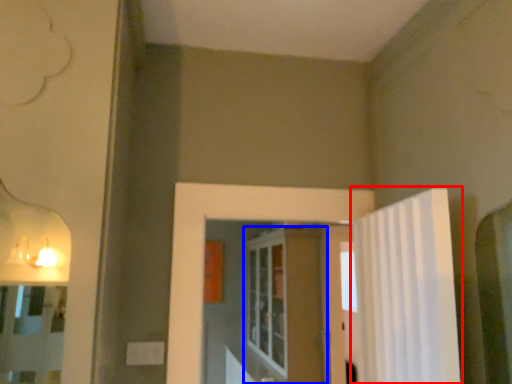
Question: Which object is closer to the camera taking this photo, shower curtain (highlighted by a red box) or screen door (highlighted by a blue box)?

Choices:
 (A) shower curtain
 (B) screen door

Answer: (A)